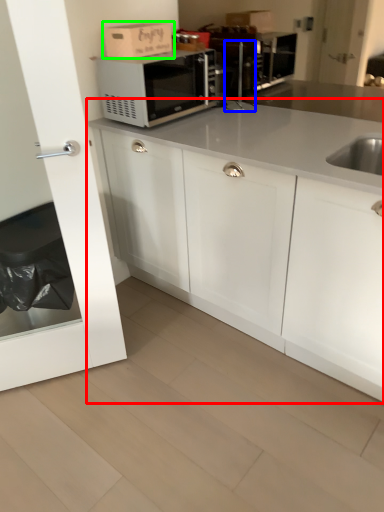
Question: Considering the real-world distances, which object is closest to cabinetry (highlighted by a red box)? faucet (highlighted by a blue box) or cardboard box (highlighted by a green box).

Choices:
 (A) faucet
 (B) cardboard box

Answer: (B)